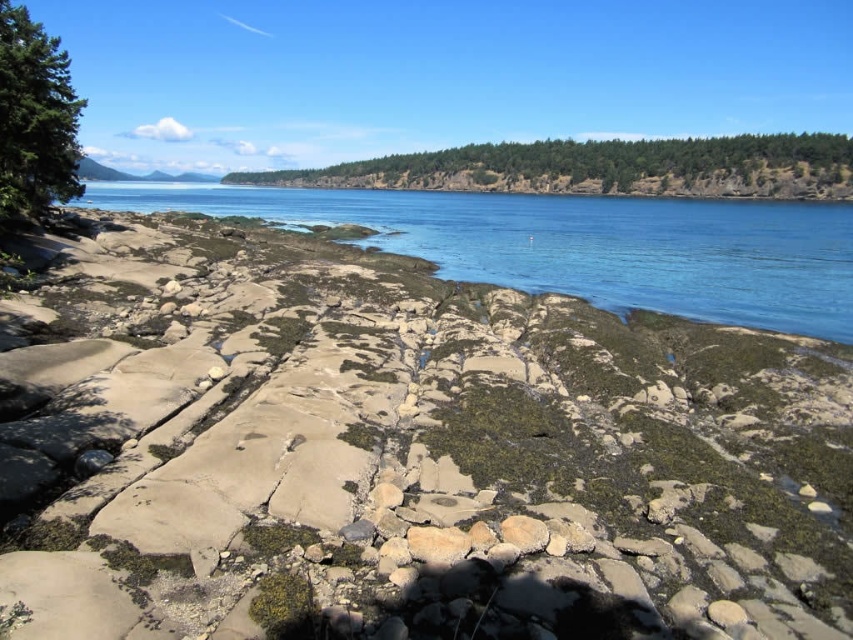
You are a photographer planning to capture the entire scene from the rocky shoreline to the distant mountains. Given that your camera can only focus on objects within a 100m width, can you fit both the blue water at center and the green leafy forest at upper center in the frame without zooming?

The blue water at center has a smaller width than the green leafy forest at upper center. Since the camera can focus on objects within a 100m width, and the total width required would depend on their combined widths. However, the description only states the comparison between their widths but does not provide exact measurements. Therefore, it is uncertain if both can fit without zooming.

Based on the photo, you are standing on the smooth sandstone rocks at center and want to see the green leafy forest at upper center. Which direction should you look to see the forest?

You should look upward because the smooth sandstone rocks at center is shorter than the green leafy forest at upper center, which is taller and located at upper center.

You are a hiker who wants to place a small tent on the smooth sandstone rocks at center or the green matte tree at upper left. Which location would be more suitable for setting up the tent based on their sizes?

The smooth sandstone rocks at center is bigger than the green matte tree at upper left, so the smooth sandstone rocks at center would be more suitable for setting up the tent as it provides a larger and more stable surface.